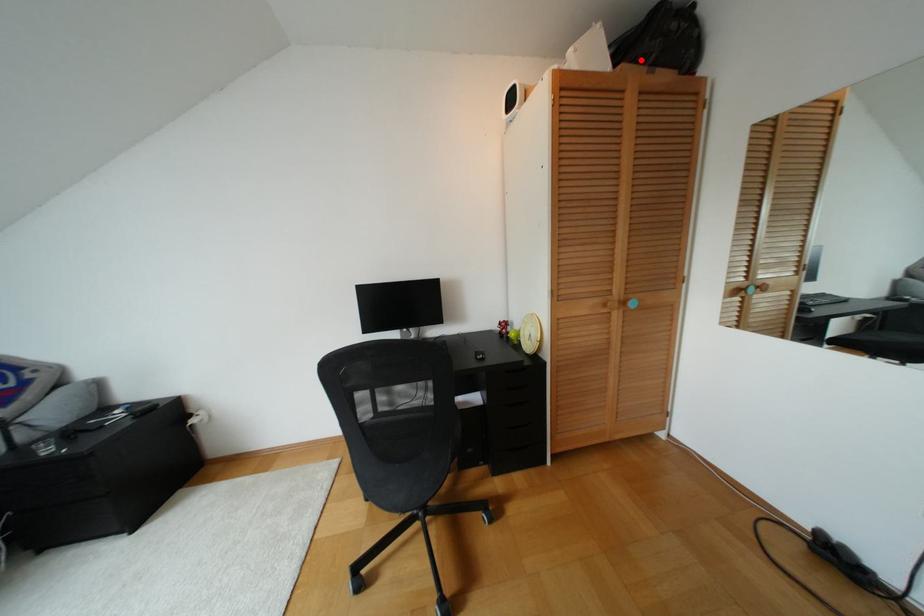
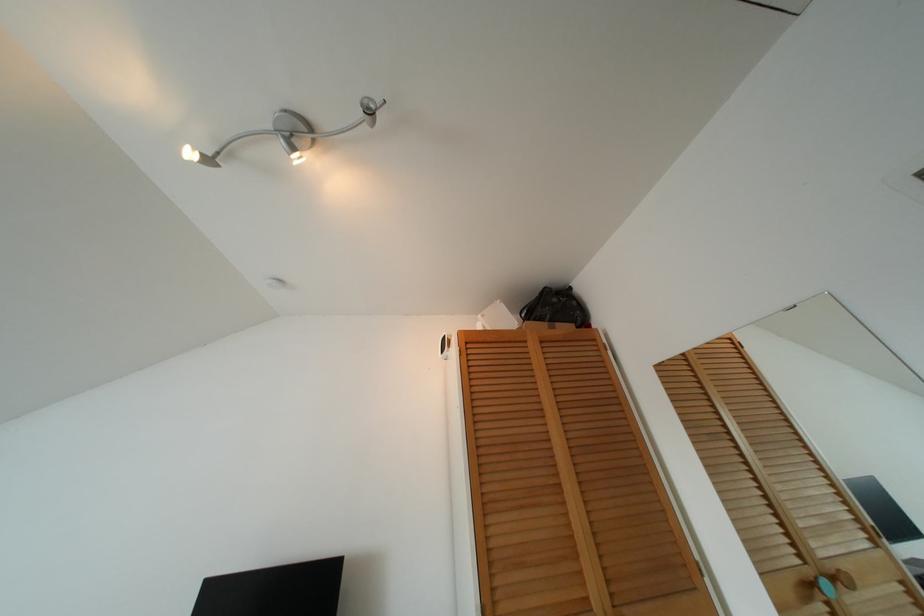
Question: I am providing you with two images of the same scene from different viewpoints. Given a red point in image1, look at the same physical point in image2. Is it:

Choices:
 (A) Closer to the viewpoint
 (B) Farther from the viewpoint

Answer: (B)